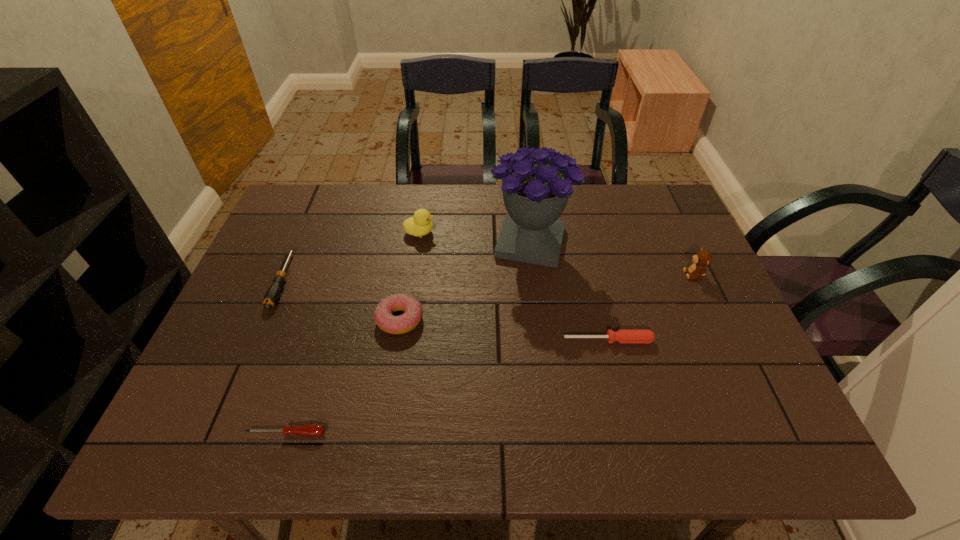
The height and width of the screenshot is (540, 960). I want to click on duckling located in the far edge section of the desktop, so click(420, 224).

I want to click on object that is at the near edge, so click(311, 430).

At what (x,y) coordinates should I click in order to perform the action: click on object that is at the right edge. Please return your answer as a coordinate pair (x, y). Image resolution: width=960 pixels, height=540 pixels. Looking at the image, I should click on (701, 259).

Identify the location of object at the near left corner. (311, 430).

Identify the location of blank space at the far edge of the desktop. (471, 222).

You are a GUI agent. You are given a task and a screenshot of the screen. Output one action in this format:
    pyautogui.click(x=<x>, y=<y>)
    Task: Click on the vacant space at the near edge
    The height and width of the screenshot is (540, 960).
    Given the screenshot: What is the action you would take?
    tap(677, 443)

This screenshot has height=540, width=960. What are the coordinates of `free space at the left edge of the desktop` in the screenshot? It's located at (254, 282).

Find the location of a particular element. The height and width of the screenshot is (540, 960). vacant space at the right edge of the desktop is located at coordinates (700, 301).

This screenshot has height=540, width=960. In the image, there is a desktop. Identify the location of vacant area at the far left corner. (331, 193).

You are a GUI agent. You are given a task and a screenshot of the screen. Output one action in this format:
    pyautogui.click(x=<x>, y=<y>)
    Task: Click on the blank space at the near left corner
    The height and width of the screenshot is (540, 960).
    Given the screenshot: What is the action you would take?
    pyautogui.click(x=205, y=456)